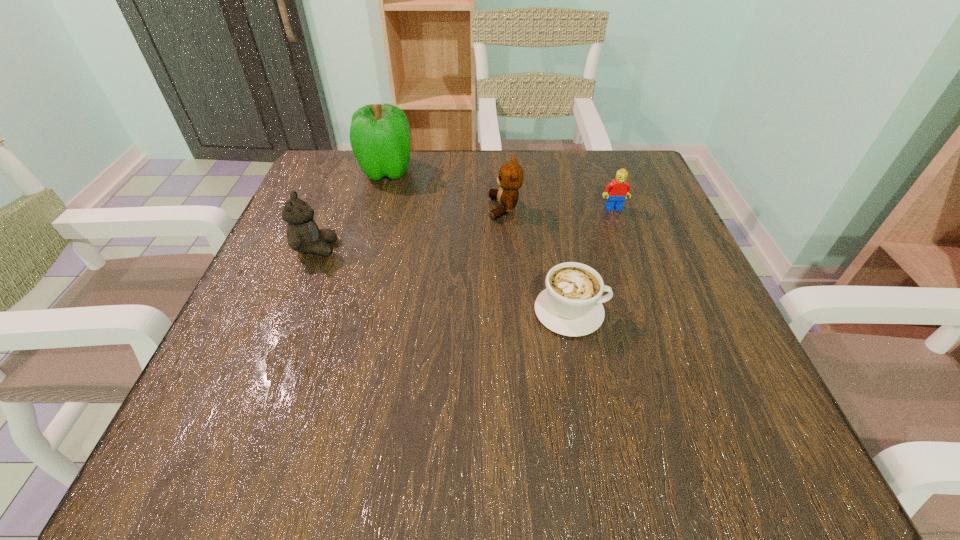
This screenshot has height=540, width=960. In order to click on bell pepper in this screenshot , I will do `click(379, 134)`.

The image size is (960, 540). I want to click on the tallest object, so (x=379, y=134).

This screenshot has height=540, width=960. I want to click on the nearer teddy bear, so click(x=303, y=234).

Find the location of `the left teddy bear`. the left teddy bear is located at coordinates click(303, 234).

You are a GUI agent. You are given a task and a screenshot of the screen. Output one action in this format:
    pyautogui.click(x=<x>, y=<y>)
    Task: Click on the third object from left to right
    The width and height of the screenshot is (960, 540).
    Given the screenshot: What is the action you would take?
    pyautogui.click(x=510, y=179)

The width and height of the screenshot is (960, 540). What are the coordinates of `the farther teddy bear` in the screenshot? It's located at (510, 179).

Where is `Lego`? The width and height of the screenshot is (960, 540). Lego is located at coordinates (616, 191).

Find the location of a particular element. the rightmost object is located at coordinates (616, 191).

What are the coordinates of `the nearest object` in the screenshot? It's located at (571, 305).

Image resolution: width=960 pixels, height=540 pixels. I want to click on the shortest object, so click(x=571, y=305).